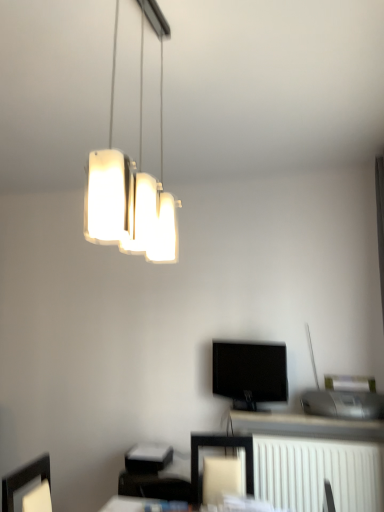
Describe the element at coordinates (250, 372) in the screenshot. The height and width of the screenshot is (512, 384). I see `black glossy tv at center` at that location.

Describe the element at coordinates (132, 181) in the screenshot. I see `white matte lamp at upper center` at that location.

Locate an element on the screen. white plastic radiator at lower right is located at coordinates (318, 473).

The image size is (384, 512). Identify the location of black glossy tv at center. (250, 372).

From the image's perspective, between white plastic radiator at lower right and white matte lamp at upper center, who is located below?

white plastic radiator at lower right is shown below in the image.

Is white plastic radiator at lower right surrounding white matte lamp at upper center?

That's incorrect, white matte lamp at upper center is not inside white plastic radiator at lower right.

Consider the image. From a real-world perspective, does white plastic radiator at lower right stand above white matte lamp at upper center?

No, from a real-world perspective, white plastic radiator at lower right is not on top of white matte lamp at upper center.

Is white plastic radiator at lower right taller or shorter than white matte lamp at upper center?

Clearly, white plastic radiator at lower right is shorter compared to white matte lamp at upper center.

In the scene shown: Is black glossy tv at center inside the boundaries of matte black frame at lower center, or outside?

black glossy tv at center lies outside matte black frame at lower center.

Are black glossy tv at center and matte black frame at lower center far apart?

No.

Considering the sizes of objects black glossy tv at center and matte black frame at lower center in the image provided, who is bigger, black glossy tv at center or matte black frame at lower center?

matte black frame at lower center is bigger.

Considering the points (238, 396) and (195, 442), which point is in front, point (238, 396) or point (195, 442)?

Positioned in front is point (195, 442).

Is the surface of white matte lamp at upper center in direct contact with white plastic radiator at lower right?

No, white matte lamp at upper center is not beside white plastic radiator at lower right.

From the image's perspective, relative to white plastic radiator at lower right, is white matte lamp at upper center above or below?

white matte lamp at upper center is situated higher than white plastic radiator at lower right in the image.

Considering the positions of objects white matte lamp at upper center and white plastic radiator at lower right in the image provided, who is in front, white matte lamp at upper center or white plastic radiator at lower right?

white matte lamp at upper center is closer to the camera.

Considering the relative sizes of white matte lamp at upper center and white plastic radiator at lower right in the image provided, is white matte lamp at upper center wider than white plastic radiator at lower right?

Incorrect, the width of white matte lamp at upper center does not surpass that of white plastic radiator at lower right.

Is matte black frame at lower center facing towards black glossy tv at center?

No.

From a real-world perspective, is matte black frame at lower center physically located above or below black glossy tv at center?

From a real-world perspective, matte black frame at lower center is physically below black glossy tv at center.

From the image's perspective, is matte black frame at lower center on top of black glossy tv at center?

No, from the image's perspective, matte black frame at lower center is not over black glossy tv at center.

Which object is closer to the camera taking this photo, matte black frame at lower center or black glossy tv at center?

matte black frame at lower center.

Is point (249, 466) positioned after point (339, 499)?

Yes, it is.

Does matte black frame at lower center have a lesser height compared to white plastic radiator at lower right?

Correct, matte black frame at lower center is not as tall as white plastic radiator at lower right.

Is matte black frame at lower center facing away from white plastic radiator at lower right?

No.

Considering the sizes of matte black frame at lower center and white matte lamp at upper center in the image, is matte black frame at lower center taller or shorter than white matte lamp at upper center?

Clearly, matte black frame at lower center is shorter compared to white matte lamp at upper center.

Which of these two, matte black frame at lower center or white matte lamp at upper center, is smaller?

With smaller size is white matte lamp at upper center.

Consider the image. Is matte black frame at lower center positioned with its back to white matte lamp at upper center?

No, white matte lamp at upper center is not at the back of matte black frame at lower center.

From a real-world perspective, does matte black frame at lower center sit lower than white matte lamp at upper center?

Yes, from a real-world perspective, matte black frame at lower center is below white matte lamp at upper center.

Based on the photo, considering the relative sizes of white plastic radiator at lower right and black glossy tv at center in the image provided, is white plastic radiator at lower right thinner than black glossy tv at center?

No.

Based on the photo, which object is closer to the camera, white plastic radiator at lower right or black glossy tv at center?

Positioned in front is white plastic radiator at lower right.

Does white plastic radiator at lower right have a greater height compared to black glossy tv at center?

Correct, white plastic radiator at lower right is much taller as black glossy tv at center.

Identify the location of lamp in front of the white plastic radiator at lower right. (132, 181).

The width and height of the screenshot is (384, 512). Find the location of `television above the matte black frame at lower center (from the image's perspective)`. television above the matte black frame at lower center (from the image's perspective) is located at coordinates (250, 372).

From the image, which object appears to be farther from matte black frame at lower center, black glossy tv at center or white matte lamp at upper center?

white matte lamp at upper center is further to matte black frame at lower center.

Considering their positions, is matte black frame at lower center positioned further to white plastic radiator at lower right than black glossy tv at center?

The object further to white plastic radiator at lower right is black glossy tv at center.

When comparing their distances from white plastic radiator at lower right, does matte black frame at lower center or white matte lamp at upper center seem further?

white matte lamp at upper center lies further to white plastic radiator at lower right than the other object.

Which object lies nearer to the anchor point white matte lamp at upper center, white plastic radiator at lower right or matte black frame at lower center?

matte black frame at lower center is closer to white matte lamp at upper center.

Looking at the image, which one is located closer to white matte lamp at upper center, matte black frame at lower center or white plastic radiator at lower right?

Among the two, matte black frame at lower center is located nearer to white matte lamp at upper center.

When comparing their distances from black glossy tv at center, does matte black frame at lower center or white matte lamp at upper center seem further?

white matte lamp at upper center is further to black glossy tv at center.

From the picture: Based on their spatial positions, is white plastic radiator at lower right or black glossy tv at center further from matte black frame at lower center?

black glossy tv at center is positioned further to the anchor matte black frame at lower center.

From the image, which object appears to be farther from black glossy tv at center, white plastic radiator at lower right or matte black frame at lower center?

Among the two, white plastic radiator at lower right is located further to black glossy tv at center.

In order to click on radiator positioned between matte black frame at lower center and black glossy tv at center from near to far in this screenshot , I will do `click(318, 473)`.

Locate an element on the screen. Image resolution: width=384 pixels, height=512 pixels. television between white matte lamp at upper center and white plastic radiator at lower right in the up-down direction is located at coordinates (250, 372).

You are a GUI agent. You are given a task and a screenshot of the screen. Output one action in this format:
    pyautogui.click(x=<x>, y=<y>)
    Task: Click on the furniture between white matte lamp at upper center and white plastic radiator at lower right in the vertical direction
    The width and height of the screenshot is (384, 512).
    Given the screenshot: What is the action you would take?
    pyautogui.click(x=221, y=447)

Locate an element on the screen. Image resolution: width=384 pixels, height=512 pixels. television between white matte lamp at upper center and matte black frame at lower center vertically is located at coordinates (250, 372).